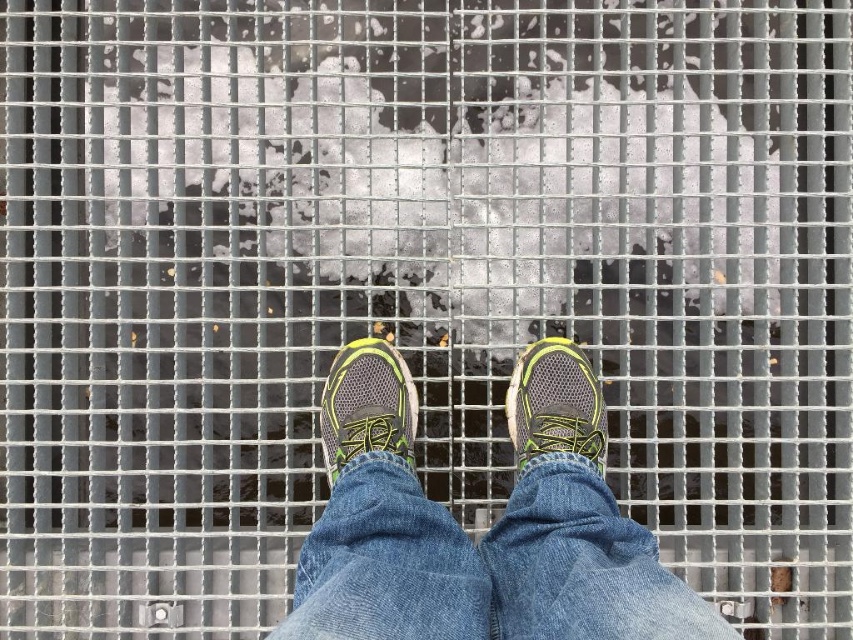
You are a delivery robot with a 2.32 meter long package. You need to move from the point marked at (437, 506) to another location. Can you fit the package between these two points without bending it?

The distance between the two points is exactly 2.32 meters, so the package can be placed straight between them without bending.

You are a pedestrian trying to cross a slippery metal grate. You notice your denim at center and matte gray running shoe at center are both on the grate. Which part of your clothing is more to the right?

The denim at center is positioned on the right side of the matte gray running shoe at center, so the denim at center is more to the right.

You are a delivery person who needs to step onto the metal grate ahead. You see the denim at center and the gray mesh shoe at center. Which part of your clothing will be closer to the grate?

The denim at center will be closer to the grate because it has a greater height compared to the gray mesh shoe at center.